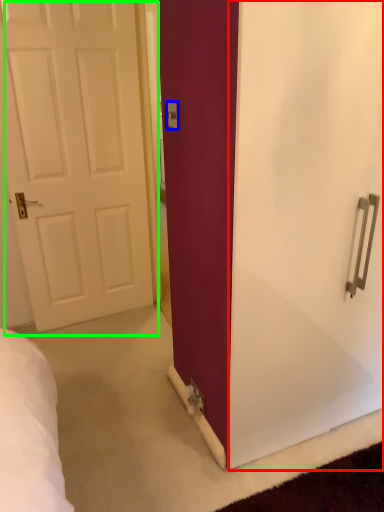
Question: Based on their relative distances, which object is nearer to screen door (highlighted by a red box)? Choose from electric outlet (highlighted by a blue box) and door (highlighted by a green box).

Choices:
 (A) electric outlet
 (B) door

Answer: (A)